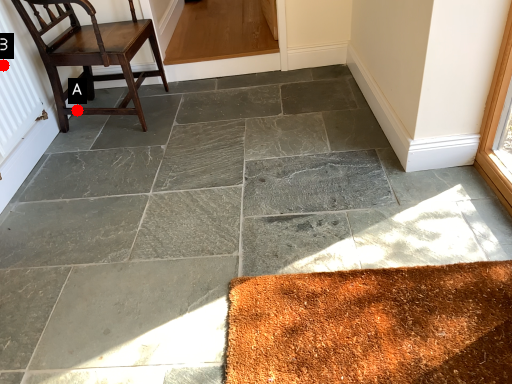
Question: Two points are circled on the image, labeled by A and B beside each circle. Which of the following is the closest to the observer?

Choices:
 (A) A is closer
 (B) B is closer

Answer: (B)